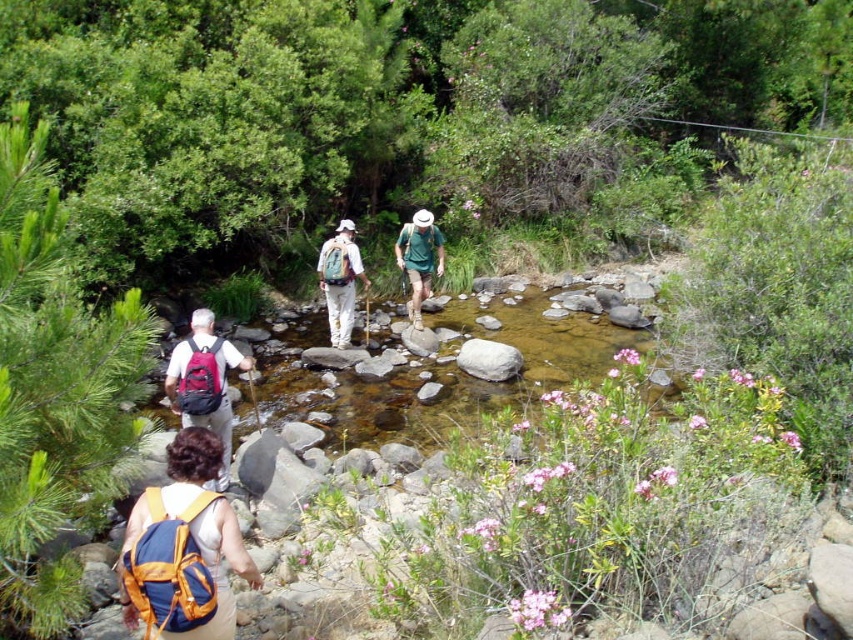
Question: Does clear water at center appear on the right side of green fabric shirt at center?

Choices:
 (A) yes
 (B) no

Answer: (A)

Question: Which point is farther to the camera?

Choices:
 (A) green fabric shirt at center
 (B) clear water at center

Answer: (A)

Question: Observing the image, what is the correct spatial positioning of blue fabric backpack at lower left in reference to white matte backpack at center?

Choices:
 (A) below
 (B) above

Answer: (A)

Question: Which of the following is the farthest from the observer?

Choices:
 (A) clear water at center
 (B) white matte backpack at center

Answer: (B)

Question: Among these points, which one is farthest from the camera?

Choices:
 (A) (206, 525)
 (B) (303, 396)
 (C) (343, 269)
 (D) (225, 394)

Answer: (C)

Question: Observing the image, what is the correct spatial positioning of blue fabric backpack at lower left in reference to white matte backpack at center?

Choices:
 (A) right
 (B) left

Answer: (A)